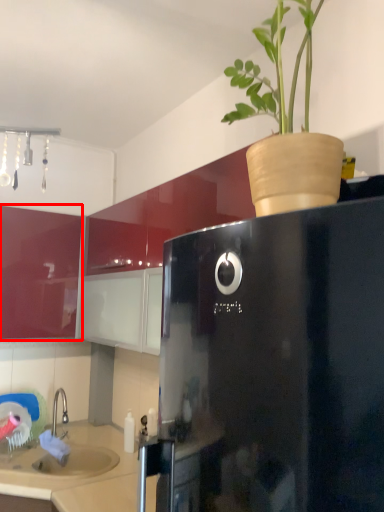
Question: From the image's perspective, where is cabinetry (annotated by the red box) located in relation to counter top in the image?

Choices:
 (A) below
 (B) above

Answer: (B)